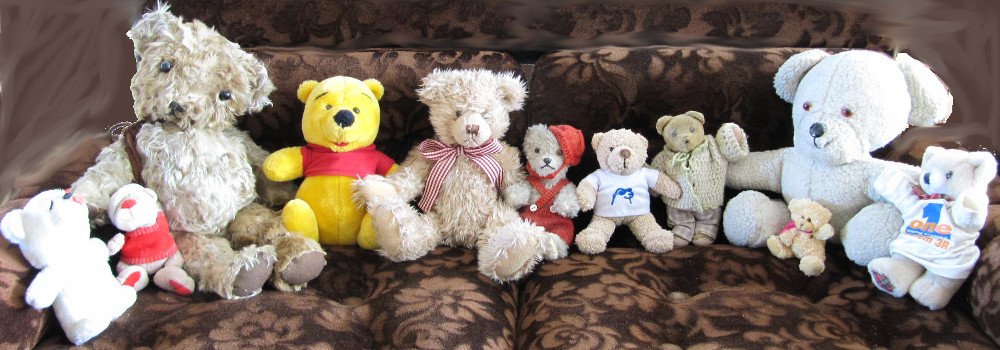
Where is `small stuffed bears`? This screenshot has height=350, width=1000. small stuffed bears is located at coordinates (90, 256), (157, 233), (550, 151), (622, 171), (697, 158), (805, 226), (921, 239).